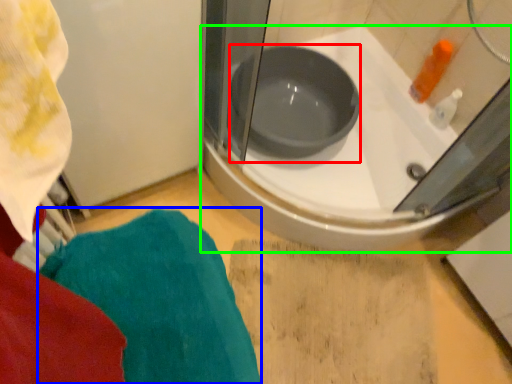
Question: Which is farther away from basin (highlighted by a red box)? bath towel (highlighted by a blue box) or bathtub (highlighted by a green box)?

Choices:
 (A) bath towel
 (B) bathtub

Answer: (A)